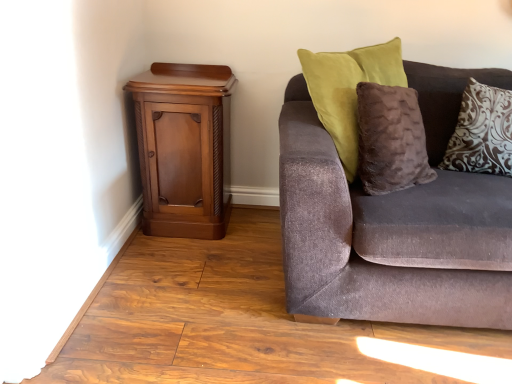
Find the location of a particular element. The image size is (512, 384). free space in front of mahogany wood cabinet at left is located at coordinates (181, 268).